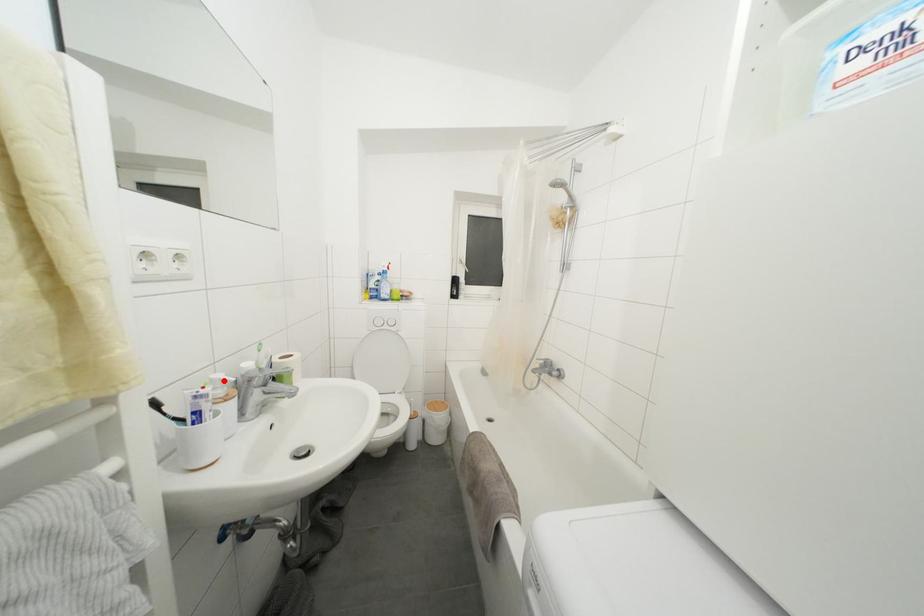
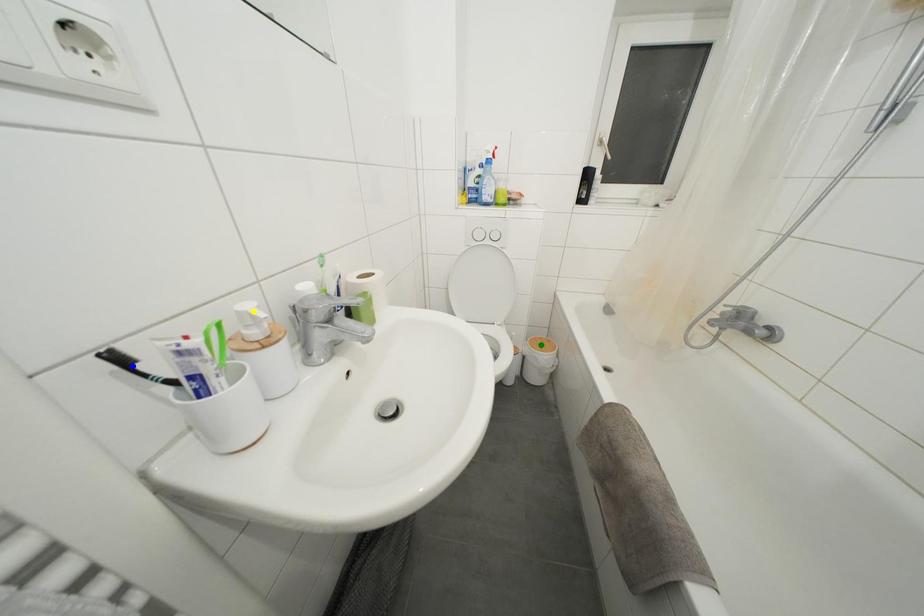
Question: I am providing you with two images of the same scene from different viewpoints. A red point is marked on the first image. You are given multiple points on the second image. In image 2, which mark is for the same physical point as the one in image 1?

Choices:
 (A) yellow point
 (B) blue point
 (C) green point

Answer: (A)